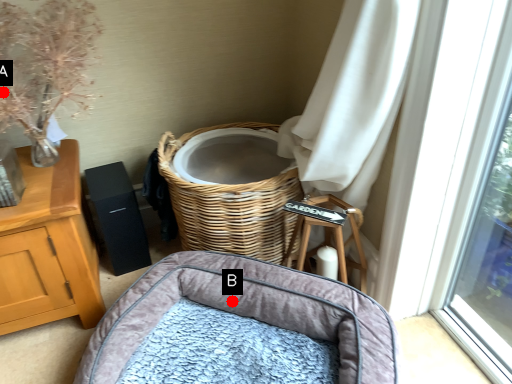
Question: Two points are circled on the image, labeled by A and B beside each circle. Which point is closer to the camera?

Choices:
 (A) A is closer
 (B) B is closer

Answer: (A)